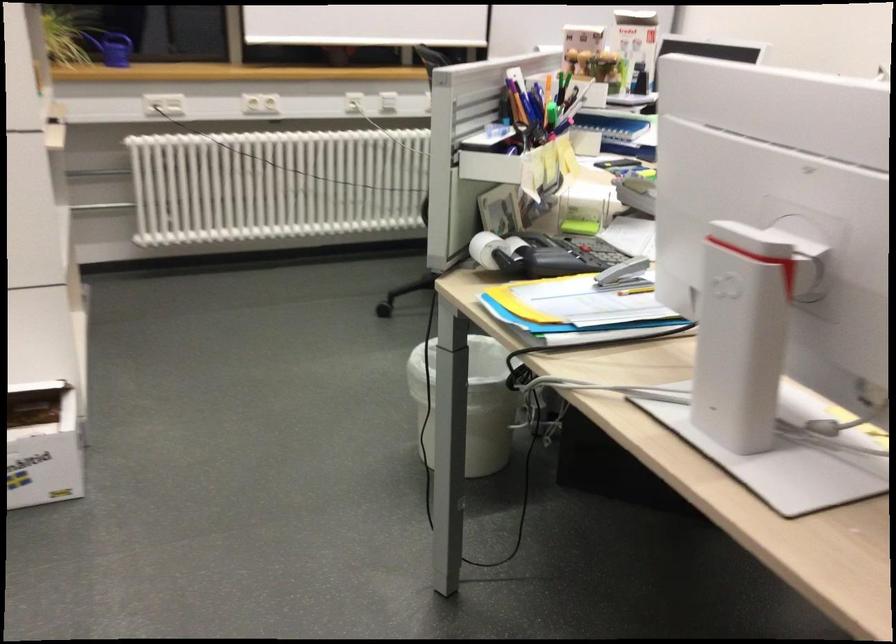
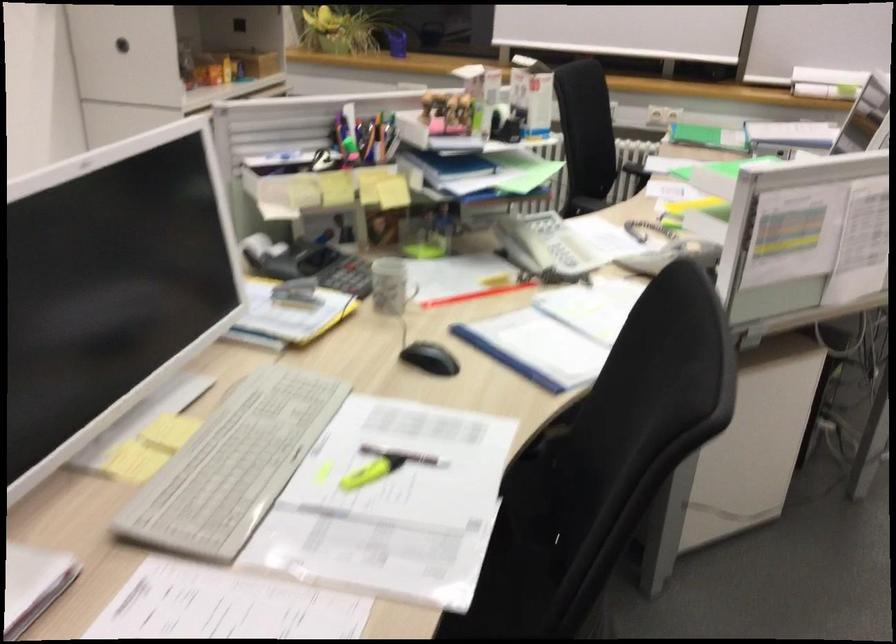
In the second image, find the point that corresponds to (x=545, y=245) in the first image.

(286, 257)